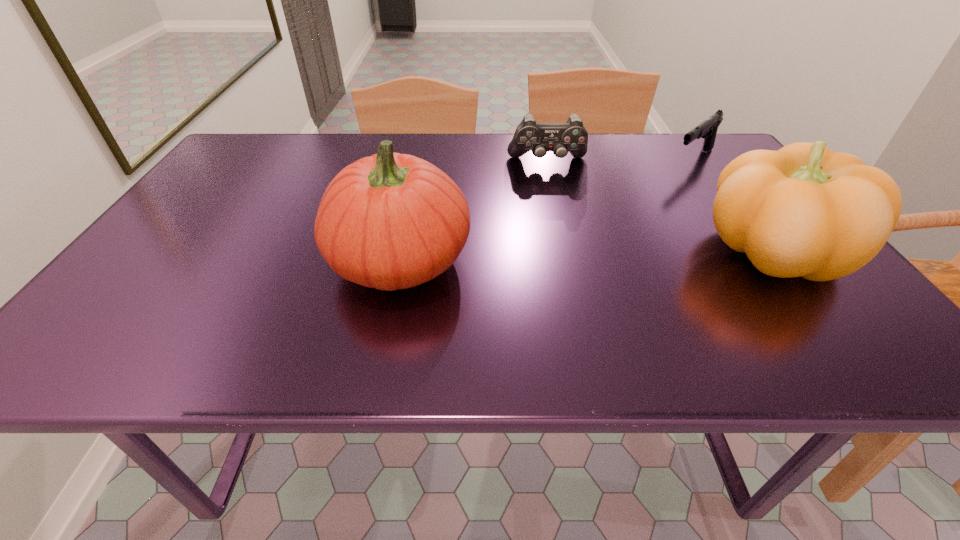
You are a GUI agent. You are given a task and a screenshot of the screen. Output one action in this format:
    pyautogui.click(x=<x>, y=<y>)
    Task: Click on the vacant space located 0.280m on the surface of the control with buttons
    This screenshot has height=540, width=960.
    Given the screenshot: What is the action you would take?
    pyautogui.click(x=562, y=233)

Identify the location of free space located 0.380m on the surface of the control with buttons. This screenshot has height=540, width=960. 567,262.

You are a GUI agent. You are given a task and a screenshot of the screen. Output one action in this format:
    pyautogui.click(x=<x>, y=<y>)
    Task: Click on the gun that is positioned at the far edge
    This screenshot has height=540, width=960.
    Given the screenshot: What is the action you would take?
    pyautogui.click(x=707, y=129)

Image resolution: width=960 pixels, height=540 pixels. Find the location of `control present at the far edge`. control present at the far edge is located at coordinates (561, 138).

At what (x,y) coordinates should I click in order to perform the action: click on pumpkin that is at the right edge. Please return your answer as a coordinate pair (x, y). The width and height of the screenshot is (960, 540). Looking at the image, I should click on (805, 211).

Where is `gun that is at the right edge`? gun that is at the right edge is located at coordinates (707, 129).

Where is `object that is at the far right corner`? Image resolution: width=960 pixels, height=540 pixels. object that is at the far right corner is located at coordinates (707, 129).

Locate an element on the screen. The height and width of the screenshot is (540, 960). object at the near right corner is located at coordinates (805, 211).

Find the location of a particular element. This screenshot has width=960, height=540. vacant region at the far edge of the desktop is located at coordinates (488, 151).

The width and height of the screenshot is (960, 540). What are the coordinates of `vacant space at the near edge` in the screenshot? It's located at (328, 294).